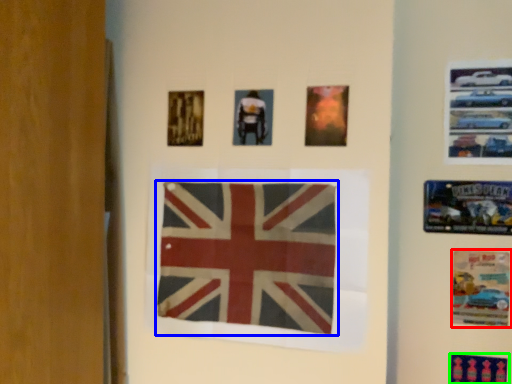
Question: Considering the real-world distances, which object is closest to poster (highlighted by a red box)? flag (highlighted by a blue box) or poster (highlighted by a green box).

Choices:
 (A) flag
 (B) poster

Answer: (B)